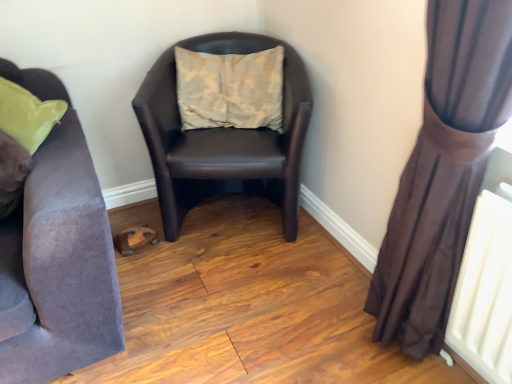
Identify the location of free area in between brown leather chair at center and brown sheer curtain at right. (283, 286).